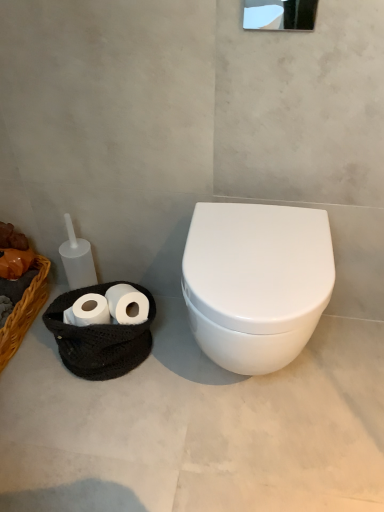
Identify the location of free space above white glossy toilet at right (from a real-world perspective). This screenshot has width=384, height=512. (208, 414).